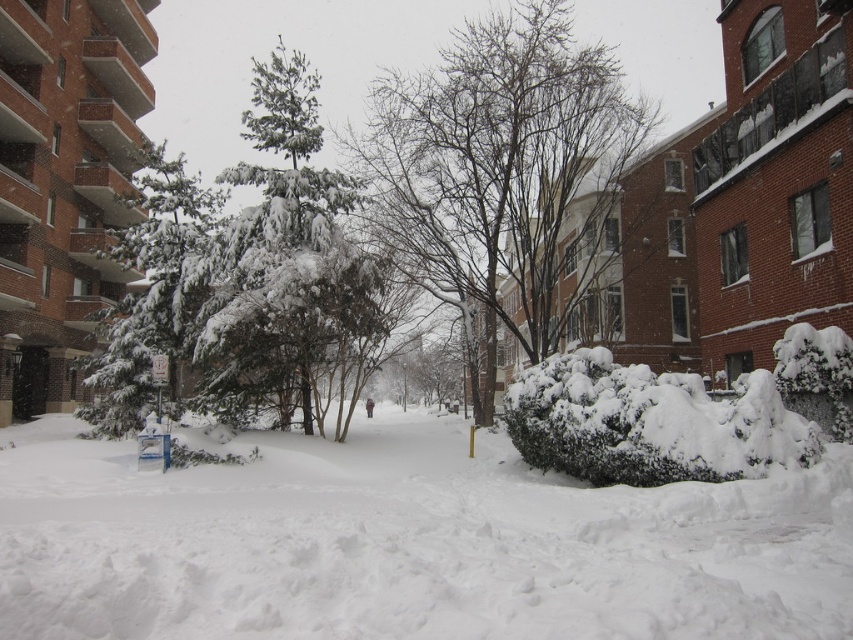
Question: Among these objects, which one is farthest from the camera?

Choices:
 (A) snow-covered bare tree at center
 (B) snow-covered evergreen at left

Answer: (A)

Question: Can you confirm if white fluffy snow at center is positioned to the left of green textured pine tree at center?

Choices:
 (A) no
 (B) yes

Answer: (A)

Question: Which point is closer to the camera taking this photo?

Choices:
 (A) tap(227, 536)
 (B) tap(424, 172)
 (C) tap(107, 381)

Answer: (A)

Question: Does white fluffy snow at center have a larger size compared to green textured pine tree at center?

Choices:
 (A) no
 (B) yes

Answer: (A)

Question: Which of the following is the closest to the observer?

Choices:
 (A) (306, 333)
 (B) (567, 492)
 (C) (114, 432)

Answer: (B)

Question: Does green textured pine tree at center appear over snow-covered evergreen at left?

Choices:
 (A) yes
 (B) no

Answer: (A)